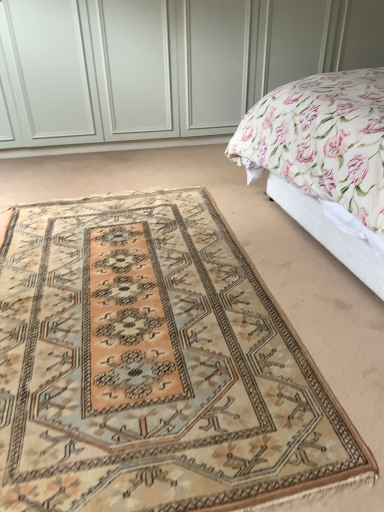
Question: From a real-world perspective, is beige wool rug at center positioned above or below floral fabric bed at upper right?

Choices:
 (A) below
 (B) above

Answer: (A)

Question: Choose the correct answer: Is beige wool rug at center inside floral fabric bed at upper right or outside it?

Choices:
 (A) outside
 (B) inside

Answer: (A)

Question: Is beige wool rug at center bigger or smaller than floral fabric bed at upper right?

Choices:
 (A) big
 (B) small

Answer: (B)

Question: Is point (289, 88) closer or farther from the camera than point (226, 253)?

Choices:
 (A) farther
 (B) closer

Answer: (A)

Question: In terms of size, does floral fabric bed at upper right appear bigger or smaller than beige wool rug at center?

Choices:
 (A) small
 (B) big

Answer: (B)

Question: From the image's perspective, relative to beige wool rug at center, is floral fabric bed at upper right above or below?

Choices:
 (A) below
 (B) above

Answer: (B)

Question: Is floral fabric bed at upper right wider or thinner than beige wool rug at center?

Choices:
 (A) thin
 (B) wide

Answer: (A)